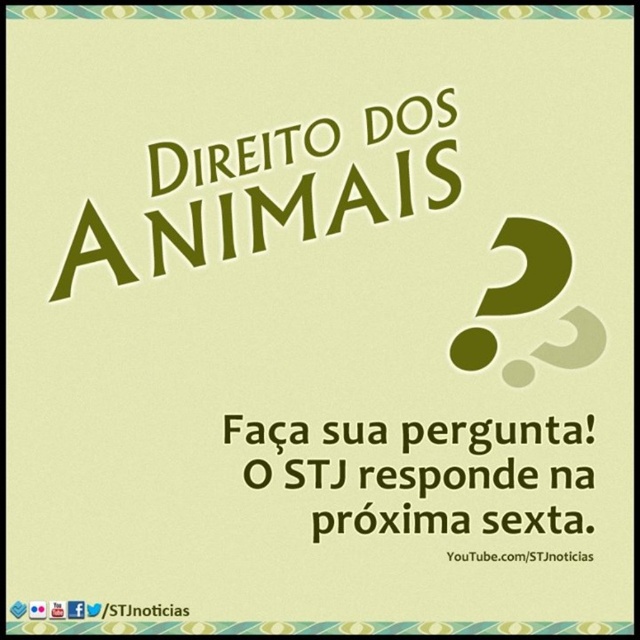
You are standing 4 feet away from the promotional graphic. Can you reach the green textured sign at upper center without moving closer?

The green textured sign at upper center is 3.61 feet away from the viewer. Since you are standing 4 feet away, you are slightly farther than the sign, so you cannot reach it without moving closer.